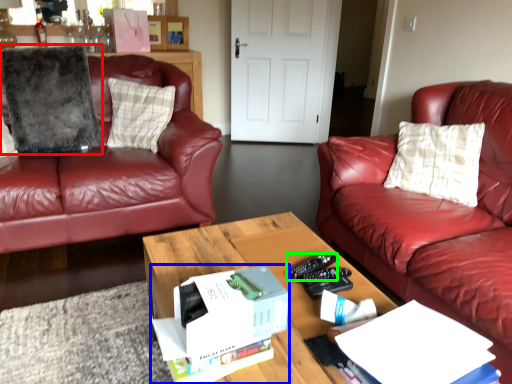
Question: Which is nearer to the pillow (highlighted by a red box)? box (highlighted by a blue box) or remote control (highlighted by a green box).

Choices:
 (A) box
 (B) remote control

Answer: (B)